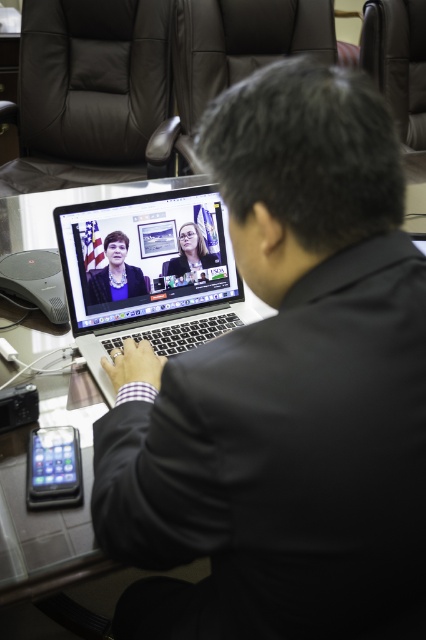
Can you confirm if sleek silver laptop at center is bigger than matte black suit at center?

Correct, sleek silver laptop at center is larger in size than matte black suit at center.

Is sleek silver laptop at center below matte black suit at center?

Yes, sleek silver laptop at center is below matte black suit at center.

From the picture: Who is more distant from viewer, (173,205) or (192,234)?

Point (192,234)

I want to click on sleek silver laptop at center, so 147,273.

Who is more forward, (118, 296) or (184, 259)?

Positioned in front is point (118, 296).

Where is `matte black woman at center`? Image resolution: width=426 pixels, height=640 pixels. matte black woman at center is located at coordinates (115, 273).

Locate an element on the screen. The image size is (426, 640). matte black woman at center is located at coordinates (115, 273).

Between sleek silver laptop at center and matte black woman at center, which one is positioned lower?

sleek silver laptop at center

Does sleek silver laptop at center have a lesser height compared to matte black woman at center?

In fact, sleek silver laptop at center may be taller than matte black woman at center.

What do you see at coordinates (147, 273) in the screenshot? I see `sleek silver laptop at center` at bounding box center [147, 273].

Where is `sleek silver laptop at center`? Image resolution: width=426 pixels, height=640 pixels. sleek silver laptop at center is located at coordinates (147, 273).